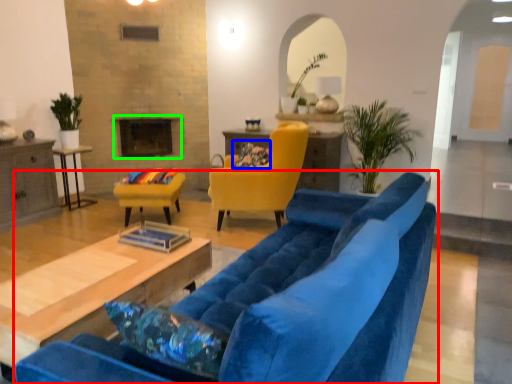
Question: Which is farther away from studio couch (highlighted by a red box)? pillow (highlighted by a blue box) or fireplace (highlighted by a green box)?

Choices:
 (A) pillow
 (B) fireplace

Answer: (B)